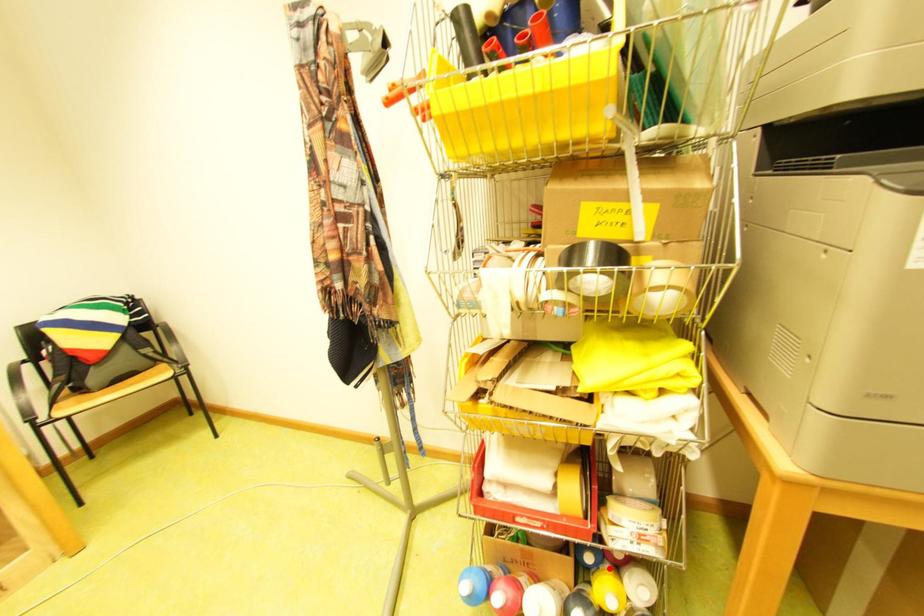
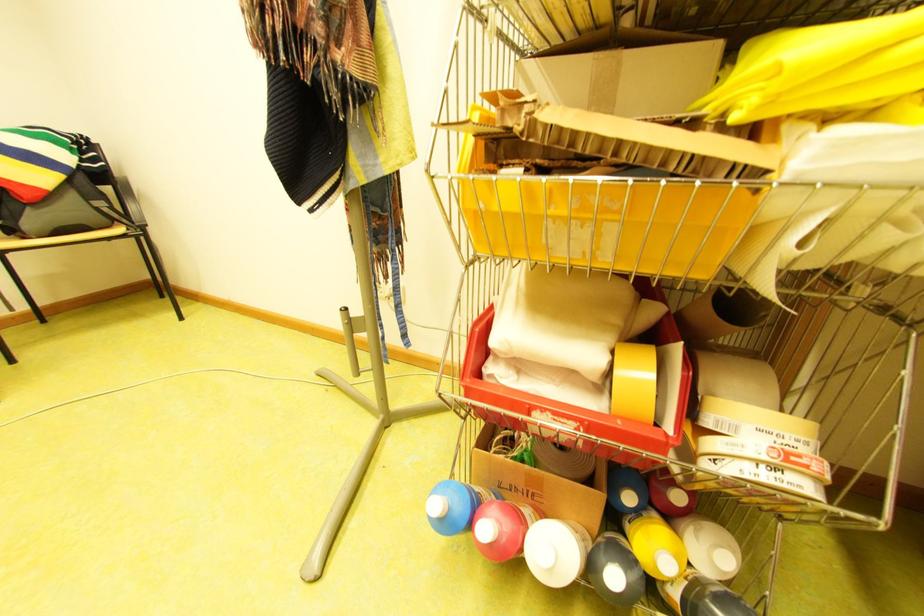
Question: I am providing you with two images of the same scene from different viewpoints. Image1 has a red point marked. In image2, the corresponding 3D location appears at what relative position? Reply with the corresponding letter.

Choices:
 (A) Closer
 (B) Farther

Answer: (B)